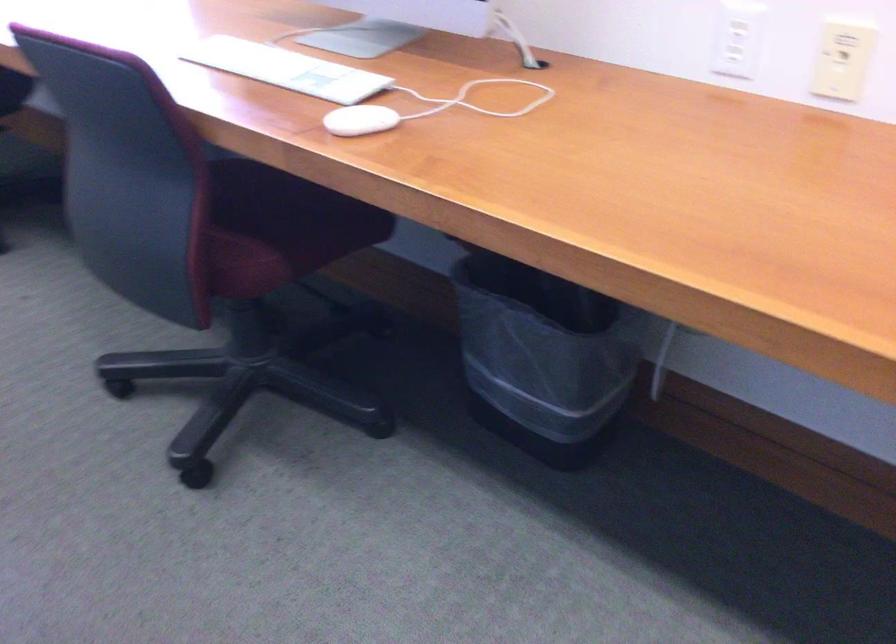
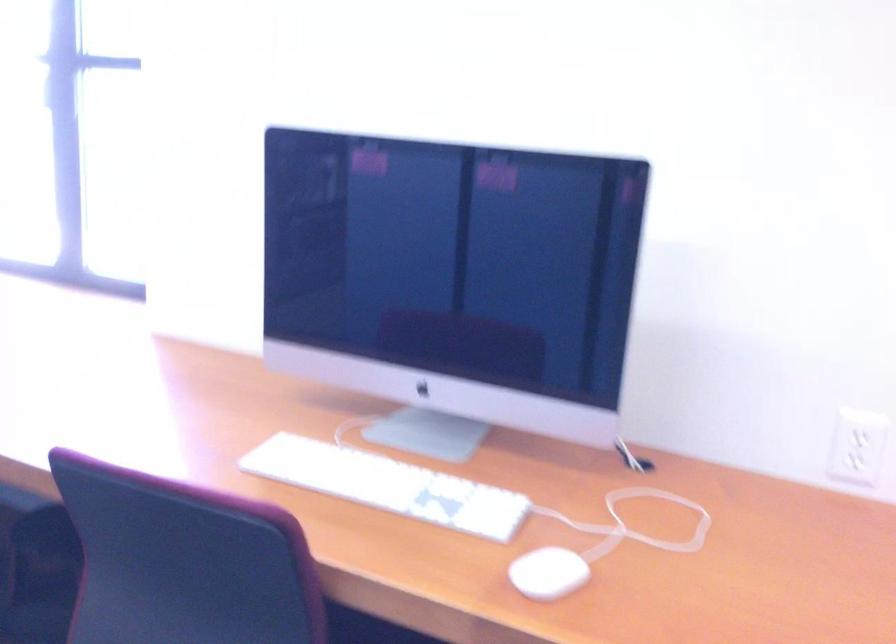
Which direction would the cameraman need to move to produce the second image?

The cameraman moved toward left, forward.